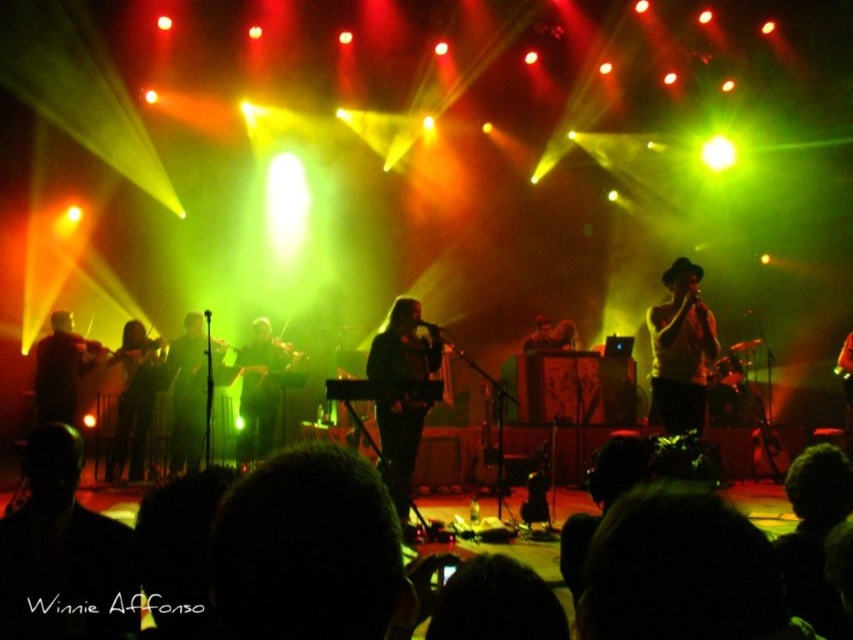
Question: Does black fabric guitar at left have a greater width compared to matte black guitar at left?

Choices:
 (A) yes
 (B) no

Answer: (B)

Question: Which object is the farthest from the shiny black microphone at center?

Choices:
 (A) matte black guitar at center
 (B) matte black guitar at left

Answer: (B)

Question: Is dark brown violin at center positioned in front of matte black guitar at left?

Choices:
 (A) yes
 (B) no

Answer: (B)

Question: From the image, what is the correct spatial relationship of black fabric guitar at left in relation to matte black guitar at left?

Choices:
 (A) below
 (B) above

Answer: (A)

Question: Which point appears farthest from the camera in this image?

Choices:
 (A) (173, 353)
 (B) (704, 352)

Answer: (A)

Question: Which object is farther from the camera taking this photo?

Choices:
 (A) shiny black microphone at center
 (B) matte black guitar at left
 (C) matte black guitar at center

Answer: (B)